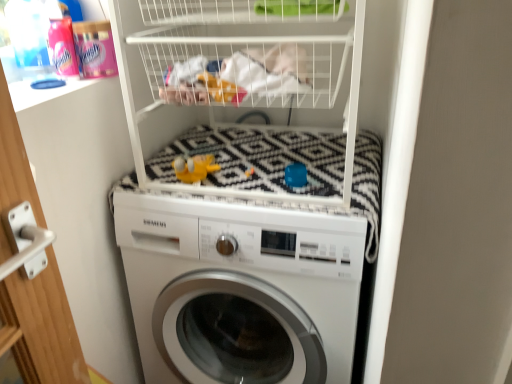
Image resolution: width=512 pixels, height=384 pixels. Identify the location of white glossy washing machine at center. (240, 290).

This screenshot has height=384, width=512. What do you see at coordinates (240, 290) in the screenshot?
I see `white glossy washing machine at center` at bounding box center [240, 290].

What is the approximate width of white glossy washing machine at center?

It is 26.65 inches.

In order to face white glossy washing machine at center, should I rotate leftwards or rightwards?

To align with it, rotate right about 1.171°.

Where is `yellow rubber duck at center`? Image resolution: width=512 pixels, height=384 pixels. yellow rubber duck at center is located at coordinates (194, 167).

Describe the element at coordinates (194, 167) in the screenshot. I see `yellow rubber duck at center` at that location.

Find the location of a particular element. white glossy washing machine at center is located at coordinates (240, 290).

Visually, is white glossy washing machine at center positioned to the left or to the right of yellow rubber duck at center?

white glossy washing machine at center is positioned on yellow rubber duck at center's right side.

Is white glossy washing machine at center further to camera compared to yellow rubber duck at center?

No, white glossy washing machine at center is closer to the viewer.

Which is less distant, (x=343, y=367) or (x=190, y=180)?

Clearly, point (x=343, y=367) is more distant from the camera than point (x=190, y=180).

From the image's perspective, is white glossy washing machine at center over yellow rubber duck at center?

Actually, white glossy washing machine at center appears below yellow rubber duck at center in the image.

From a real-world perspective, does white glossy washing machine at center stand above yellow rubber duck at center?

No, from a real-world perspective, white glossy washing machine at center is not above yellow rubber duck at center.

Can you confirm if white glossy washing machine at center is wider than yellow rubber duck at center?

Indeed, white glossy washing machine at center has a greater width compared to yellow rubber duck at center.

In terms of height, does white glossy washing machine at center look taller or shorter compared to yellow rubber duck at center?

Considering their sizes, white glossy washing machine at center has more height than yellow rubber duck at center.

In terms of size, does white glossy washing machine at center appear bigger or smaller than yellow rubber duck at center?

Considering their sizes, white glossy washing machine at center takes up more space than yellow rubber duck at center.

Can we say white glossy washing machine at center lies outside yellow rubber duck at center?

Absolutely, white glossy washing machine at center is external to yellow rubber duck at center.

Is the surface of white glossy washing machine at center in direct contact with yellow rubber duck at center?

No, white glossy washing machine at center is not touching yellow rubber duck at center.

Could you tell me if white glossy washing machine at center is facing yellow rubber duck at center?

No.

How different are the orientations of white glossy washing machine at center and yellow rubber duck at center in degrees?

The facing directions of white glossy washing machine at center and yellow rubber duck at center are 0.124 degrees apart.

Measure the distance from white glossy washing machine at center to yellow rubber duck at center.

white glossy washing machine at center is 13.86 inches from yellow rubber duck at center.

Locate an element on the screen. The width and height of the screenshot is (512, 384). washing machine to the right of yellow rubber duck at center is located at coordinates (240, 290).

Which is more to the right, yellow rubber duck at center or white glossy washing machine at center?

white glossy washing machine at center.

Is yellow rubber duck at center in front of or behind white glossy washing machine at center in the image?

In the image, yellow rubber duck at center appears behind white glossy washing machine at center.

Considering the positions of points (197, 160) and (339, 250), is point (197, 160) farther from camera compared to point (339, 250)?

That is True.

From the image's perspective, between yellow rubber duck at center and white glossy washing machine at center, which one is located above?

yellow rubber duck at center appears higher in the image.

From a real-world perspective, is yellow rubber duck at center below white glossy washing machine at center?

Actually, yellow rubber duck at center is physically above white glossy washing machine at center in the real world.

Does yellow rubber duck at center have a lesser width compared to white glossy washing machine at center?

Yes, yellow rubber duck at center is thinner than white glossy washing machine at center.

Is yellow rubber duck at center taller than white glossy washing machine at center?

Incorrect, the height of yellow rubber duck at center is not larger of that of white glossy washing machine at center.

Which of these two, yellow rubber duck at center or white glossy washing machine at center, is bigger?

white glossy washing machine at center is bigger.

Is white glossy washing machine at center surrounded by yellow rubber duck at center?

That's incorrect, white glossy washing machine at center is not inside yellow rubber duck at center.

Are yellow rubber duck at center and white glossy washing machine at center beside each other?

yellow rubber duck at center and white glossy washing machine at center are not in contact.

Is yellow rubber duck at center facing away from white glossy washing machine at center?

No, yellow rubber duck at center is not facing away from white glossy washing machine at center.

Consider the image. How many degrees apart are the facing directions of yellow rubber duck at center and white glossy washing machine at center?

The angular difference between yellow rubber duck at center and white glossy washing machine at center is 0.124 degrees.

In order to click on toy lying behind the white glossy washing machine at center in this screenshot , I will do `click(194, 167)`.

The width and height of the screenshot is (512, 384). In order to click on toy above the white glossy washing machine at center (from the image's perspective) in this screenshot , I will do `click(194, 167)`.

Identify the location of washing machine in front of the yellow rubber duck at center. [x=240, y=290].